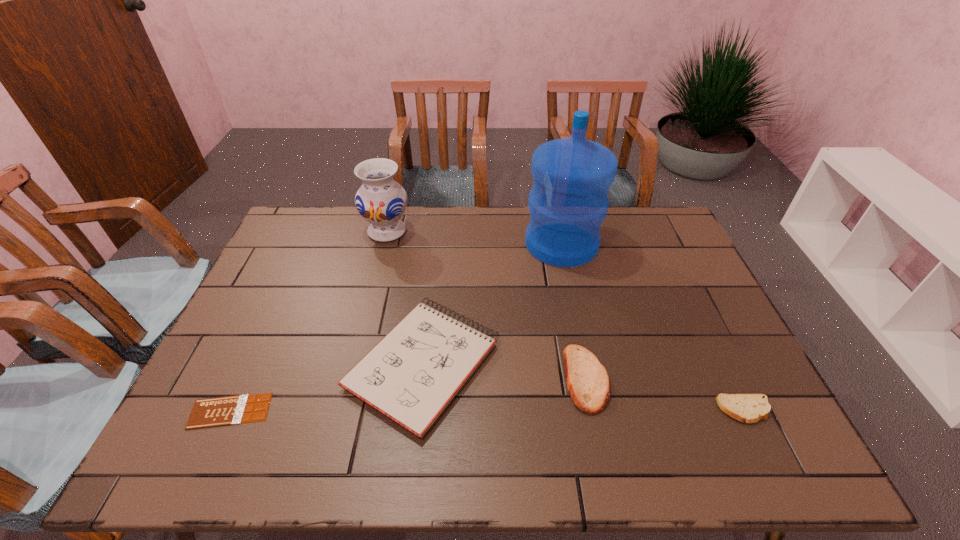
Locate an element on the screen. The height and width of the screenshot is (540, 960). blank space located on the right of the notepad is located at coordinates (538, 364).

I want to click on vacant space situated on the front of the left pita bread, so click(x=600, y=448).

This screenshot has width=960, height=540. Find the location of `vacant space located on the left of the rightmost object`. vacant space located on the left of the rightmost object is located at coordinates (610, 410).

Find the location of `vacant space situated on the back of the chocolate bar`. vacant space situated on the back of the chocolate bar is located at coordinates (289, 283).

Find the location of a particular element. This screenshot has width=960, height=540. water jug that is at the far edge is located at coordinates (568, 202).

Where is `vase that is at the far edge`? vase that is at the far edge is located at coordinates (380, 200).

Where is `object that is positioned at the near edge`? object that is positioned at the near edge is located at coordinates (411, 375).

I want to click on object at the left edge, so click(x=211, y=412).

At what (x,y) coordinates should I click in order to perform the action: click on object at the right edge. Please return your answer as a coordinate pair (x, y). Looking at the image, I should click on (750, 408).

In order to click on vacant area at the far edge of the desktop in this screenshot , I will do `click(428, 232)`.